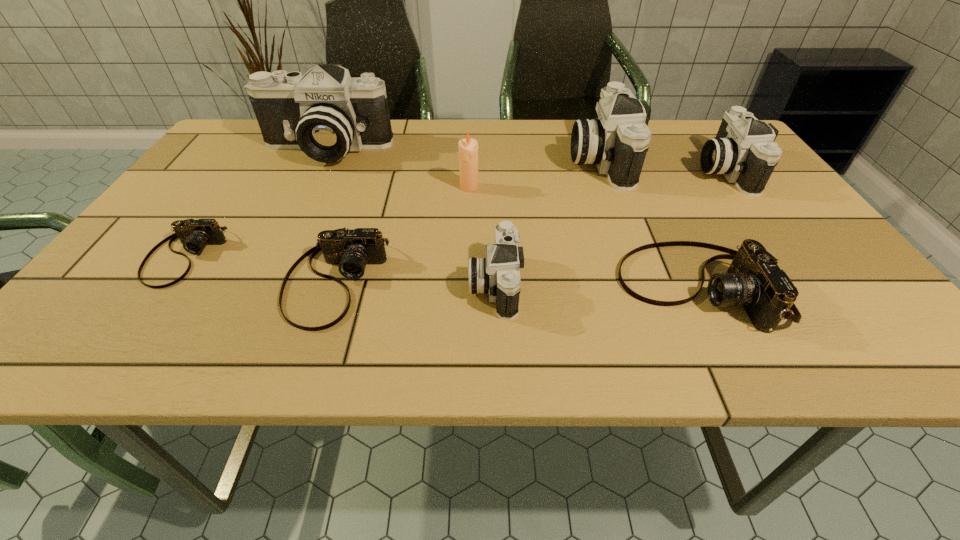
Identify which object is the third closest to the shortest camera. Please provide its 2D coordinates. Your answer should be formatted as a tuple, i.e. [(x, y)], where the tuple contains the x and y coordinates of a point satisfying the conditions above.

[(468, 148)]

This screenshot has height=540, width=960. Find the location of `the sixth closest object to the seventh tallest object`. the sixth closest object to the seventh tallest object is located at coordinates (617, 141).

I want to click on camera identified as the fourth closest to the shortest object, so click(617, 141).

At what (x,y) coordinates should I click in order to perform the action: click on camera that can be found as the third closest to the second smallest black camera. Please return your answer as a coordinate pair (x, y). The width and height of the screenshot is (960, 540). Looking at the image, I should click on (498, 274).

Where is `black camera that is the third nearest to the third black camera from left to right`? The height and width of the screenshot is (540, 960). black camera that is the third nearest to the third black camera from left to right is located at coordinates (325, 113).

Identify which black camera is the nearest to the third shortest object. Please provide its 2D coordinates. Your answer should be formatted as a tuple, i.e. [(x, y)], where the tuple contains the x and y coordinates of a point satisfying the conditions above.

[(744, 151)]

Where is `brown camera that is the second closest to the tallest camera`? Image resolution: width=960 pixels, height=540 pixels. brown camera that is the second closest to the tallest camera is located at coordinates (352, 249).

Identify which brown camera is the second closest to the candle. Please provide its 2D coordinates. Your answer should be formatted as a tuple, i.e. [(x, y)], where the tuple contains the x and y coordinates of a point satisfying the conditions above.

[(753, 280)]

You are a GUI agent. You are given a task and a screenshot of the screen. Output one action in this format:
    pyautogui.click(x=<x>, y=<y>)
    Task: Click on the vacant area that satisfies the following two spatial constraints: 1. on the front side of the candle; 2. on the right side of the biggest black camera
    The width and height of the screenshot is (960, 540).
    Given the screenshot: What is the action you would take?
    pyautogui.click(x=307, y=187)

Where is `free space that satisfies the following two spatial constraints: 1. on the front side of the second tallest camera; 2. on the right side of the third biggest black camera`? free space that satisfies the following two spatial constraints: 1. on the front side of the second tallest camera; 2. on the right side of the third biggest black camera is located at coordinates (604, 170).